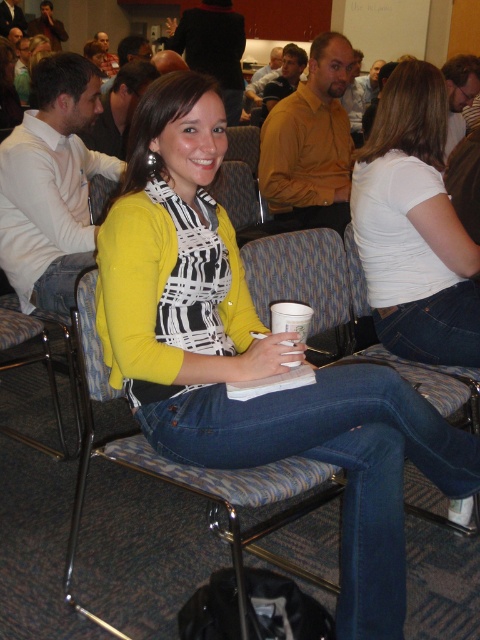
Is yellow matte cardigan at center below denim at center?

No, yellow matte cardigan at center is not below denim at center.

In the scene shown: Is yellow matte cardigan at center smaller than denim at center?

Actually, yellow matte cardigan at center might be larger than denim at center.

Is point (192, 381) behind point (217, 435)?

Yes, it is.

Locate an element on the screen. The image size is (480, 640). yellow matte cardigan at center is located at coordinates (252, 356).

Between point (232, 467) and point (479, 340), which one is positioned behind?

The point (479, 340) is more distant.

Is denim at center positioned behind white matte shirt at center?

No.

This screenshot has width=480, height=640. Find the location of `denim at center`. denim at center is located at coordinates (334, 464).

Is yellow matte cardigan at center smaller than blue denim jeans at center?

Actually, yellow matte cardigan at center might be larger than blue denim jeans at center.

Does yellow matte cardigan at center appear on the left side of blue denim jeans at center?

In fact, yellow matte cardigan at center is to the right of blue denim jeans at center.

Locate an element on the screen. yellow matte cardigan at center is located at coordinates (252, 356).

Find the location of a particular element. yellow matte cardigan at center is located at coordinates (252, 356).